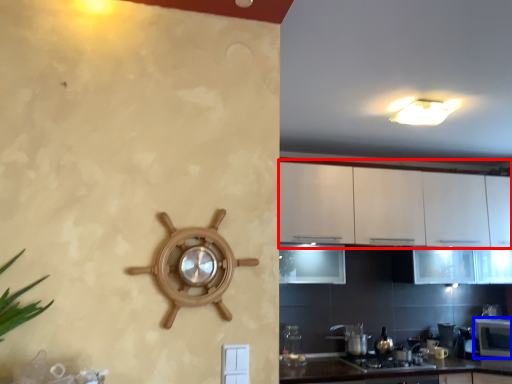
Question: Which point is further to the camera, cabinetry (highlighted by a red box) or microwave (highlighted by a blue box)?

Choices:
 (A) cabinetry
 (B) microwave

Answer: (B)